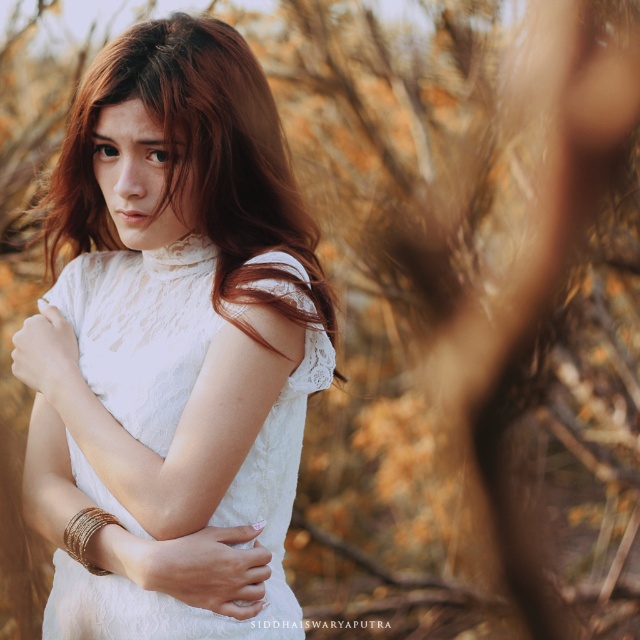
Question: Estimate the real-world distances between objects in this image. Which object is closer to the white lace dress at center?

Choices:
 (A) gold metallic bangles at center
 (B) gold metallic bracelet at lower left

Answer: (A)

Question: Is gold metallic bangles at center to the left of gold metallic bracelet at lower left from the viewer's perspective?

Choices:
 (A) no
 (B) yes

Answer: (A)

Question: Observing the image, what is the correct spatial positioning of white lace dress at center in reference to gold metallic bracelet at lower left?

Choices:
 (A) left
 (B) right

Answer: (B)

Question: Among these points, which one is farthest from the camera?

Choices:
 (A) (77, 472)
 (B) (74, 540)

Answer: (A)

Question: Based on their relative distances, which object is farther from the gold metallic bracelet at lower left?

Choices:
 (A) white lace dress at center
 (B) gold metallic bangles at center

Answer: (A)

Question: Does white lace dress at center have a greater width compared to gold metallic bangles at center?

Choices:
 (A) no
 (B) yes

Answer: (B)